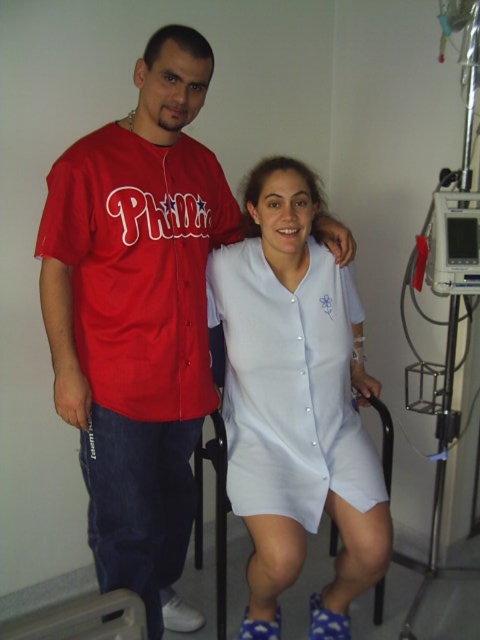
Does matte jersey at center appear over matte jersey at left?

Incorrect, matte jersey at center is not positioned above matte jersey at left.

Can you confirm if matte jersey at center is positioned below matte jersey at left?

Yes, matte jersey at center is below matte jersey at left.

What do you see at coordinates (137, 317) in the screenshot? Image resolution: width=480 pixels, height=640 pixels. I see `matte jersey at center` at bounding box center [137, 317].

Image resolution: width=480 pixels, height=640 pixels. Find the location of `matte jersey at center`. matte jersey at center is located at coordinates (137, 317).

Is point (262, 282) positioned in front of point (176, 221)?

No, it is behind (176, 221).

Describe the element at coordinates (296, 403) in the screenshot. The width and height of the screenshot is (480, 640). I see `white matte hospital gown at center` at that location.

Identify the location of white matte hospital gown at center. (296, 403).

Consider the image. Is matte jersey at center in front of white matte hospital gown at center?

Yes, matte jersey at center is in front of white matte hospital gown at center.

This screenshot has height=640, width=480. What do you see at coordinates (137, 317) in the screenshot? I see `matte jersey at center` at bounding box center [137, 317].

Is point (40, 227) farther from viewer compared to point (267, 493)?

No.

Where is `matte jersey at center`? matte jersey at center is located at coordinates (137, 317).